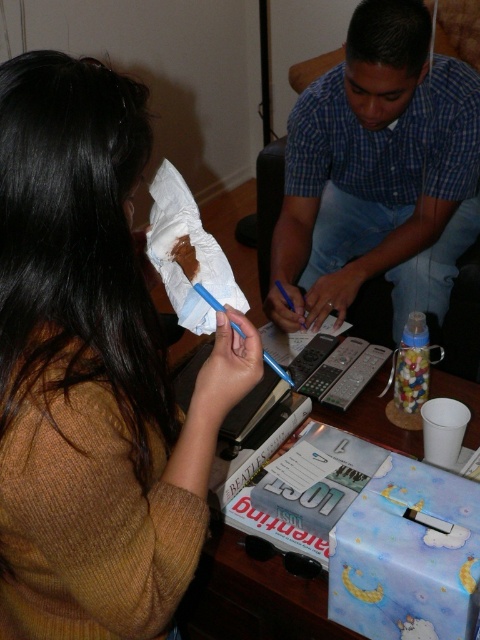
Is brown knitted sweater at upper left above blue plaid shirt at center?

Actually, brown knitted sweater at upper left is below blue plaid shirt at center.

Is point (156, 464) less distant than point (340, 208)?

Yes, point (156, 464) is closer to viewer.

Is point (45, 108) behind point (350, 36)?

No, it is in front of (350, 36).

Identify the location of brown knitted sweater at upper left. (93, 371).

From the picture: Is brown knitted sweater at upper left bigger than white soft toilet paper at center?

Yes.

Does brown knitted sweater at upper left appear under white soft toilet paper at center?

Correct, brown knitted sweater at upper left is located below white soft toilet paper at center.

Is point (143, 618) closer to camera compared to point (196, 228)?

Yes, it is.

Identify the location of brown knitted sweater at upper left. Image resolution: width=480 pixels, height=640 pixels. (93, 371).

Does brown knitted sweater at upper left come in front of white paper towel at upper center?

Yes.

Is brown knitted sweater at upper left positioned behind white paper towel at upper center?

That is False.

You are a GUI agent. You are given a task and a screenshot of the screen. Output one action in this format:
    pyautogui.click(x=<x>, y=<y>)
    Task: Click on the brown knitted sweater at upper left
    This screenshot has width=480, height=640.
    Given the screenshot: What is the action you would take?
    pyautogui.click(x=93, y=371)